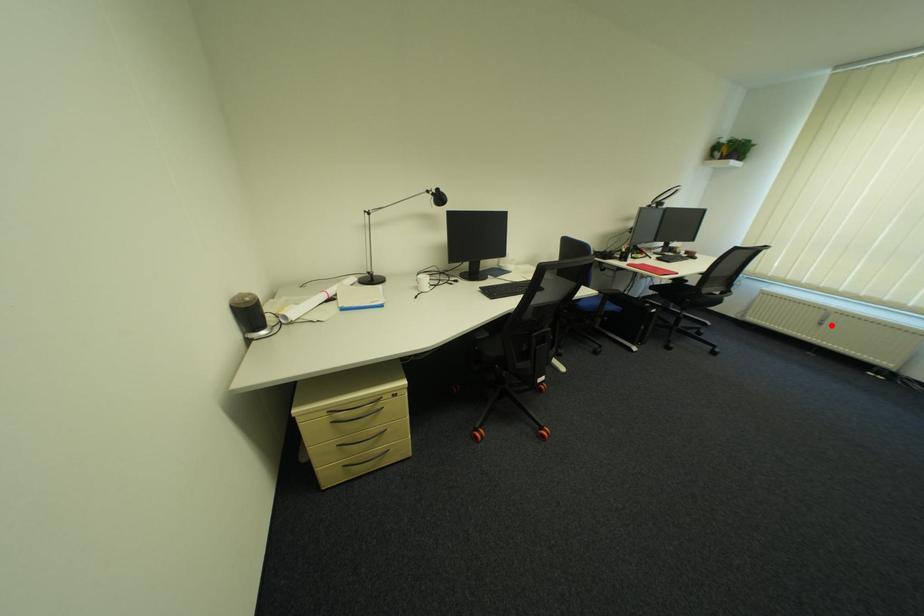
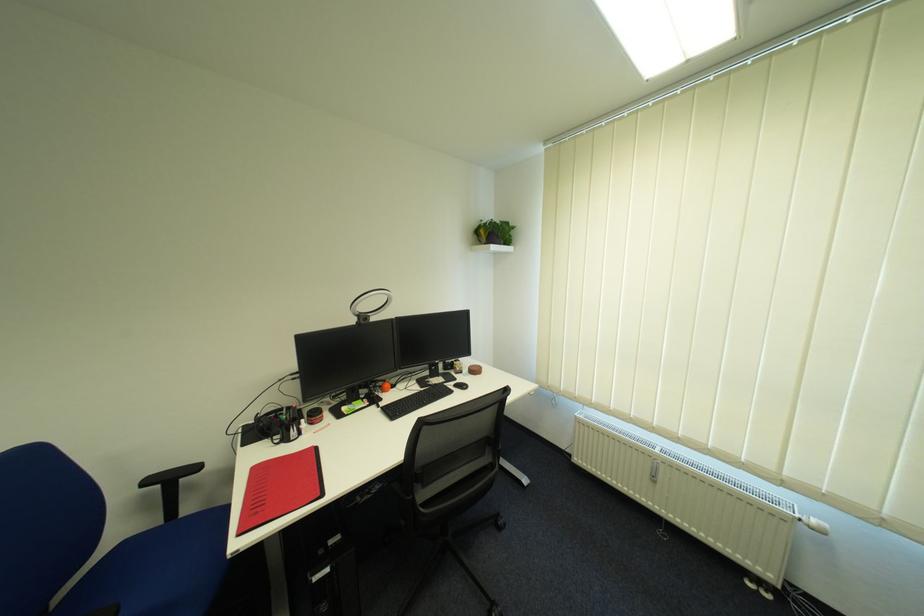
Question: I am providing you with two images of the same scene from different viewpoints. A red point is shown in image1. For the corresponding object point in image2, is it positioned nearer or farther from the camera?

Choices:
 (A) Nearer
 (B) Farther

Answer: (A)